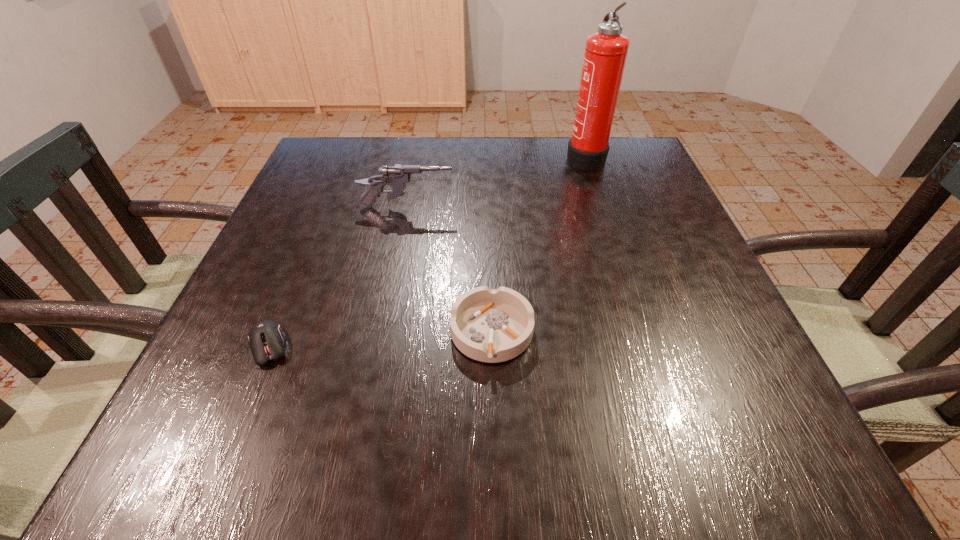
Find the location of `fire extinguisher`. fire extinguisher is located at coordinates (605, 55).

The height and width of the screenshot is (540, 960). I want to click on the rightmost object, so click(605, 55).

Locate an element on the screen. The width and height of the screenshot is (960, 540). the third nearest object is located at coordinates point(397,177).

The width and height of the screenshot is (960, 540). What are the coordinates of `the second object from left to right` in the screenshot? It's located at (397, 177).

This screenshot has height=540, width=960. What are the coordinates of `the third object from left to right` in the screenshot? It's located at (487, 325).

This screenshot has height=540, width=960. I want to click on computer mouse, so click(266, 339).

The width and height of the screenshot is (960, 540). I want to click on the shortest object, so click(266, 339).

The image size is (960, 540). I want to click on vacant space located 0.180m on the front-facing side of the tallest object, so click(x=496, y=157).

At what (x,y) coordinates should I click in order to perform the action: click on free spot located on the front-facing side of the tallest object. Please return your answer as a coordinate pair (x, y). This screenshot has height=540, width=960. Looking at the image, I should click on (500, 157).

This screenshot has width=960, height=540. Identify the location of free location located on the front-facing side of the tallest object. (504, 157).